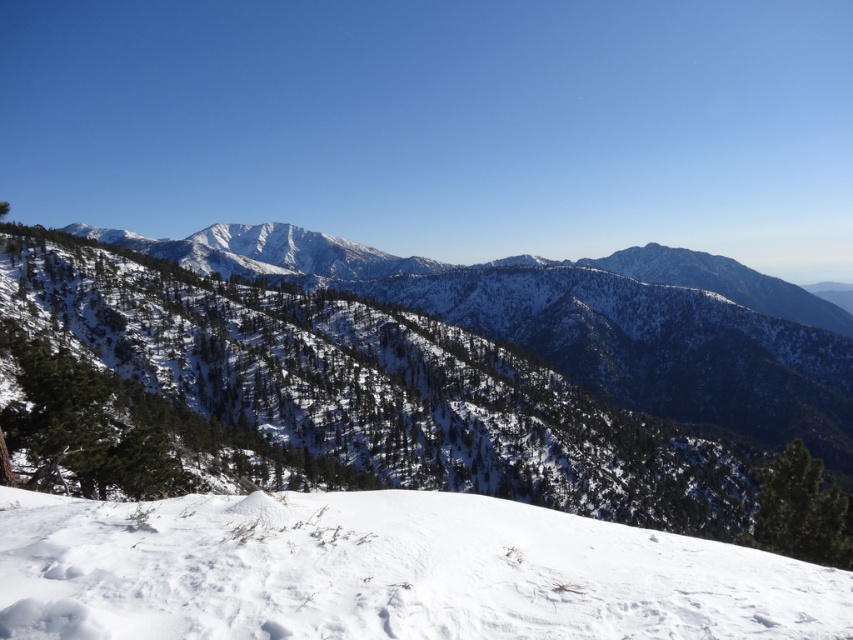
Which is in front, point (666, 554) or point (135, 289)?

Point (666, 554) is in front.

From the picture: Between white snow at lower center and white snow-covered mountain at center, which one is positioned lower?

white snow at lower center

Does point (422, 628) come closer to viewer compared to point (357, 454)?

Yes, it is.

This screenshot has width=853, height=640. Identify the location of white snow at lower center. (387, 572).